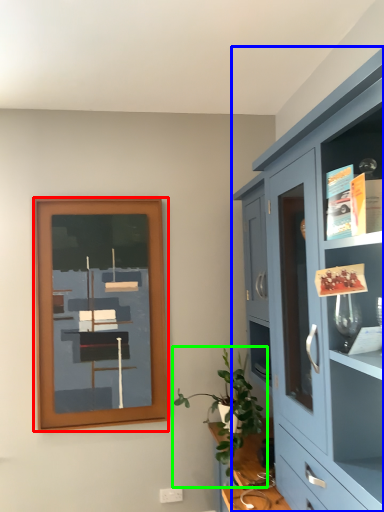
Question: Estimate the real-world distances between objects in this image. Which object is closer to picture frame (highlighted by a red box), cabinetry (highlighted by a blue box) or houseplant (highlighted by a green box)?

Choices:
 (A) cabinetry
 (B) houseplant

Answer: (B)